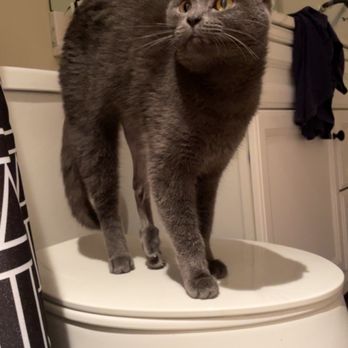
I want to click on shower curtain, so click(x=15, y=289).